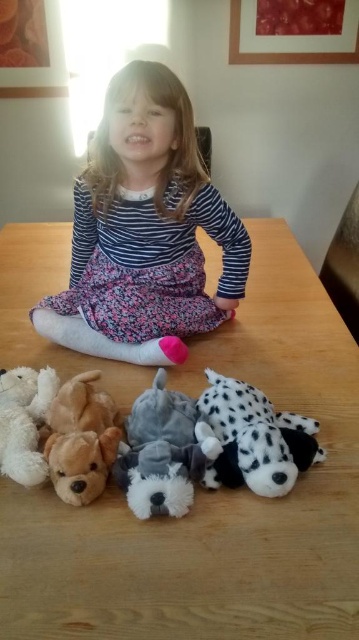
You are a photographer trying to capture a clear shot of the soft plush dogs at lower center and the spotted plush dog at lower center. Since you want both in focus, which one should you adjust your camera focus to prioritize based on their positions?

You should prioritize focusing on the soft plush dogs at lower center because it is closer to the viewer than the spotted plush dog at lower center, so adjusting focus for the closer object ensures both are in focus.

You are standing in front of the wooden table where the girl is sitting. You want to place a new book on the striped fabric at center. If your arm can reach 3 feet, can you comfortably place the book without moving closer?

The striped fabric at center is 3.29 feet away from the viewer. Since your arm can reach 3 feet, you cannot comfortably place the book without moving closer because the distance is slightly beyond your reach.